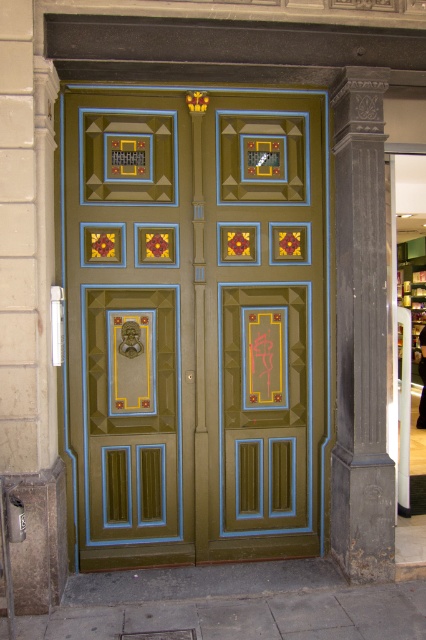
Question: Is matte olive-green door at center to the left of dark gray stone column at right from the viewer's perspective?

Choices:
 (A) no
 (B) yes

Answer: (B)

Question: Among these objects, which one is nearest to the camera?

Choices:
 (A) dark gray stone column at right
 (B) matte olive-green door at center

Answer: (A)

Question: Which point is closer to the camera?

Choices:
 (A) matte olive-green door at center
 (B) dark gray stone column at right

Answer: (B)

Question: Which object is farther from the camera taking this photo?

Choices:
 (A) matte olive-green door at center
 (B) dark gray stone column at right

Answer: (A)

Question: Is matte olive-green door at center to the left of dark gray stone column at right from the viewer's perspective?

Choices:
 (A) yes
 (B) no

Answer: (A)

Question: Is matte olive-green door at center smaller than dark gray stone column at right?

Choices:
 (A) yes
 (B) no

Answer: (B)